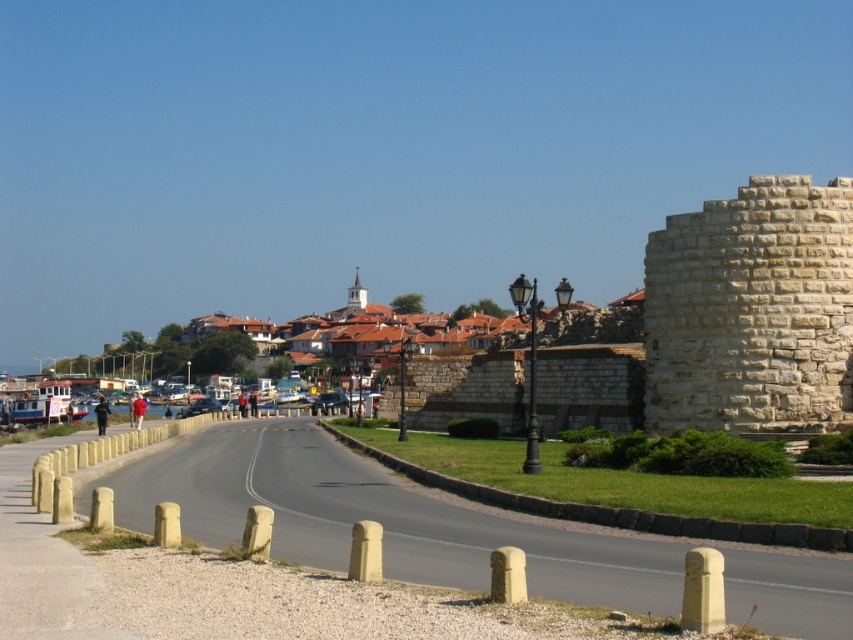
Does white stone tower at right have a greater width compared to white stone tower at center?

Incorrect, white stone tower at right's width does not surpass white stone tower at center's.

Locate an element on the screen. white stone tower at right is located at coordinates (752, 310).

Where is `white stone tower at right`? The height and width of the screenshot is (640, 853). white stone tower at right is located at coordinates (752, 310).